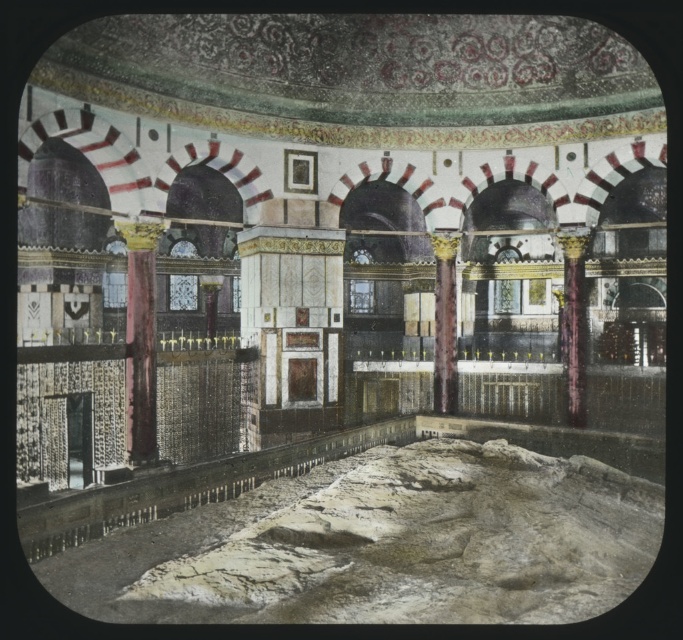
In the scene shown: You are standing in this ornately decorated space and want to move from the point at coordinate (x=574, y=406) to the point at coordinate (x=443, y=253). Which direction should you move to get closer to the camera?

To move closer to the camera, you should move towards point (x=443, y=253) because point (x=574, y=406) is already closer to the camera than point (x=443, y=253). Wait, this seems contradictory. Let me check the description again. The description says point (x=574, y=406) is closer to the camera than point (x=443, y=253). Therefore, if you want to move from point (x=574, y=406) towards the camera, you would actually need to move in the direction away from point (x=443, y=253). However, the question asks to move from 0.63

You are an architect designing a replica of this space. You need to ensure the marble column at center and the maroon polished column at center are proportionate. Which column should be placed where to maintain the architectural balance?

The marble column at center should be placed in a more prominent location since it is larger than the maroon polished column at center, ensuring architectural balance.